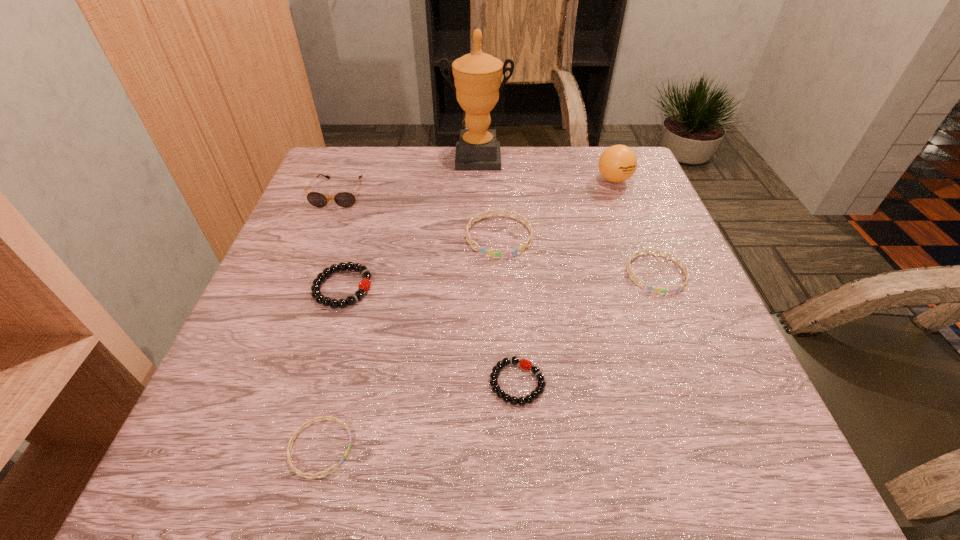
Where is `the second nearest bracelet`? The image size is (960, 540). the second nearest bracelet is located at coordinates (500, 393).

Where is `the second nearest object`? the second nearest object is located at coordinates point(500,393).

You are a GUI agent. You are given a task and a screenshot of the screen. Output one action in this format:
    pyautogui.click(x=<x>, y=<y>)
    Task: Click on the shortest bracelet
    
    Given the screenshot: What is the action you would take?
    pyautogui.click(x=302, y=474)

Identify the location of the nearest object. (302, 474).

At what (x,y) coordinates should I click in order to perform the action: click on vacant space located 0.070m at the front of the award with handles. Please return your answer as a coordinate pair (x, y). Looking at the image, I should click on (477, 185).

At what (x,y) coordinates should I click in order to perform the action: click on free space located 0.130m on the side with brand of the ping-pong ball. Please return your answer as a coordinate pair (x, y). Looking at the image, I should click on (631, 222).

Find the location of a particular element. This screenshot has height=540, width=960. free spot located on the lenses of the sixth shortest object is located at coordinates 287,325.

Find the location of `vacant space located on the surface of the second blue bracelet from left to right showing star-shaped elements`. vacant space located on the surface of the second blue bracelet from left to right showing star-shaped elements is located at coordinates (502, 298).

In order to click on free space located on the back of the left black bracelet in this screenshot , I will do `click(356, 244)`.

Where is `free space located on the surface of the rightmost bracelet showing star-shaped elements`? free space located on the surface of the rightmost bracelet showing star-shaped elements is located at coordinates (689, 356).